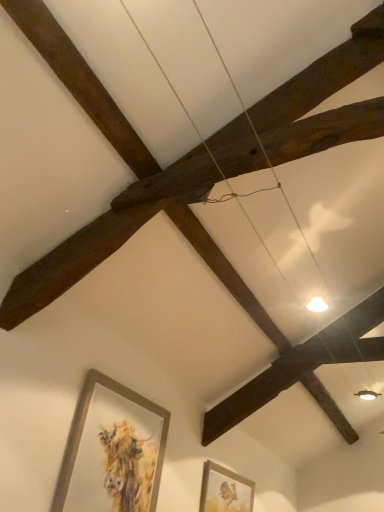
Describe the element at coordinates (225, 490) in the screenshot. The height and width of the screenshot is (512, 384). I see `matte gold picture frame at lower right, which appears as the first picture frame when viewed from the back` at that location.

Locate an element on the screen. The height and width of the screenshot is (512, 384). matte gold picture frame at lower right, which ranks as the 2th picture frame in left-to-right order is located at coordinates (225, 490).

This screenshot has width=384, height=512. What do you see at coordinates (112, 450) in the screenshot? I see `gold metallic picture frame at lower left, placed as the second picture frame when sorted from right to left` at bounding box center [112, 450].

Find the location of a particular element. The width and height of the screenshot is (384, 512). gold metallic picture frame at lower left, positioned as the 2th picture frame in back-to-front order is located at coordinates (112, 450).

Identify the location of matte gold picture frame at lower right, which appears as the first picture frame when viewed from the back. The image size is (384, 512). (225, 490).

Can you confirm if matte gold picture frame at lower right, which ranks as the 2th picture frame in left-to-right order, is positioned to the right of gold metallic picture frame at lower left, which appears as the first picture frame when viewed from the left?

Yes.

Is matte gold picture frame at lower right, which is counted as the 1th picture frame, starting from the right, further to the viewer compared to gold metallic picture frame at lower left, marked as the 2th picture frame in a bottom-to-top arrangement?

That is True.

Which point is more forward, (204,477) or (99,504)?

The point (99,504) is in front.

From the image's perspective, is matte gold picture frame at lower right, which is counted as the 1th picture frame, starting from the right, positioned above or below gold metallic picture frame at lower left, which appears as the first picture frame when viewed from the left?

matte gold picture frame at lower right, which is counted as the 1th picture frame, starting from the right, is below gold metallic picture frame at lower left, which appears as the first picture frame when viewed from the left.

From a real-world perspective, between matte gold picture frame at lower right, acting as the second picture frame starting from the front, and gold metallic picture frame at lower left, marked as the 2th picture frame in a bottom-to-top arrangement, who is vertically lower?

matte gold picture frame at lower right, acting as the second picture frame starting from the front, is physically lower.

Does matte gold picture frame at lower right, which appears as the first picture frame when viewed from the back, have a lesser width compared to gold metallic picture frame at lower left, which appears as the first picture frame when viewed from the left?

In fact, matte gold picture frame at lower right, which appears as the first picture frame when viewed from the back, might be wider than gold metallic picture frame at lower left, which appears as the first picture frame when viewed from the left.

Considering the sizes of matte gold picture frame at lower right, arranged as the first picture frame when ordered from the bottom, and gold metallic picture frame at lower left, which appears as the first picture frame when viewed from the left, in the image, is matte gold picture frame at lower right, arranged as the first picture frame when ordered from the bottom, taller or shorter than gold metallic picture frame at lower left, which appears as the first picture frame when viewed from the left,?

matte gold picture frame at lower right, arranged as the first picture frame when ordered from the bottom, is shorter than gold metallic picture frame at lower left, which appears as the first picture frame when viewed from the left.

Looking at the image, does matte gold picture frame at lower right, which ranks as the 2th picture frame in left-to-right order, seem bigger or smaller compared to gold metallic picture frame at lower left, which is the first picture frame in top-to-bottom order?

matte gold picture frame at lower right, which ranks as the 2th picture frame in left-to-right order, is smaller than gold metallic picture frame at lower left, which is the first picture frame in top-to-bottom order.

Is matte gold picture frame at lower right, which is counted as the 1th picture frame, starting from the right, located outside gold metallic picture frame at lower left, which appears as the first picture frame when viewed from the left?

Absolutely, matte gold picture frame at lower right, which is counted as the 1th picture frame, starting from the right, is external to gold metallic picture frame at lower left, which appears as the first picture frame when viewed from the left.

In the scene shown: Would you consider matte gold picture frame at lower right, which appears as the first picture frame when viewed from the back, to be distant from gold metallic picture frame at lower left, which ranks as the first picture frame in front-to-back order?

Yes.

Is matte gold picture frame at lower right, arranged as the first picture frame when ordered from the bottom, oriented away from gold metallic picture frame at lower left, which appears as the first picture frame when viewed from the left?

That's not correct — matte gold picture frame at lower right, arranged as the first picture frame when ordered from the bottom, is not looking away from gold metallic picture frame at lower left, which appears as the first picture frame when viewed from the left.

Could you measure the distance between matte gold picture frame at lower right, acting as the second picture frame starting from the front, and gold metallic picture frame at lower left, which ranks as the first picture frame in front-to-back order?

matte gold picture frame at lower right, acting as the second picture frame starting from the front, is 3.96 feet away from gold metallic picture frame at lower left, which ranks as the first picture frame in front-to-back order.

This screenshot has height=512, width=384. What are the coordinates of `picture frame above the matte gold picture frame at lower right, which appears as the first picture frame when viewed from the back (from the image's perspective)` in the screenshot? It's located at (112, 450).

Looking at this image, can you confirm if gold metallic picture frame at lower left, marked as the 2th picture frame in a bottom-to-top arrangement, is positioned to the right of matte gold picture frame at lower right, which appears as the first picture frame when viewed from the back?

In fact, gold metallic picture frame at lower left, marked as the 2th picture frame in a bottom-to-top arrangement, is to the left of matte gold picture frame at lower right, which appears as the first picture frame when viewed from the back.

Is gold metallic picture frame at lower left, marked as the 2th picture frame in a bottom-to-top arrangement, in front of or behind matte gold picture frame at lower right, which appears as the first picture frame when viewed from the back, in the image?

gold metallic picture frame at lower left, marked as the 2th picture frame in a bottom-to-top arrangement, is in front of matte gold picture frame at lower right, which appears as the first picture frame when viewed from the back.

Is point (105, 389) closer to camera compared to point (207, 468)?

Yes, it is.

From the image's perspective, is gold metallic picture frame at lower left, which appears as the first picture frame when viewed from the left, over matte gold picture frame at lower right, acting as the second picture frame starting from the front?

Yes.

From a real-world perspective, between gold metallic picture frame at lower left, which is the first picture frame in top-to-bottom order, and matte gold picture frame at lower right, which is counted as the 1th picture frame, starting from the right, who is vertically lower?

matte gold picture frame at lower right, which is counted as the 1th picture frame, starting from the right.

Between gold metallic picture frame at lower left, positioned as the 2th picture frame in back-to-front order, and matte gold picture frame at lower right, which is counted as the 1th picture frame, starting from the right, which one has smaller width?

gold metallic picture frame at lower left, positioned as the 2th picture frame in back-to-front order.

Is gold metallic picture frame at lower left, which ranks as the first picture frame in front-to-back order, taller or shorter than matte gold picture frame at lower right, which ranks as the 2th picture frame in left-to-right order?

Considering their sizes, gold metallic picture frame at lower left, which ranks as the first picture frame in front-to-back order, has more height than matte gold picture frame at lower right, which ranks as the 2th picture frame in left-to-right order.

Which of these two, gold metallic picture frame at lower left, which ranks as the first picture frame in front-to-back order, or matte gold picture frame at lower right, arranged as the first picture frame when ordered from the bottom, is smaller?

matte gold picture frame at lower right, arranged as the first picture frame when ordered from the bottom, is smaller.

Is gold metallic picture frame at lower left, which is the first picture frame in top-to-bottom order, not within matte gold picture frame at lower right, which ranks as the 2th picture frame in left-to-right order?

gold metallic picture frame at lower left, which is the first picture frame in top-to-bottom order, lies outside matte gold picture frame at lower right, which ranks as the 2th picture frame in left-to-right order,'s area.

In the scene shown: Is gold metallic picture frame at lower left, which appears as the first picture frame when viewed from the left, not close to matte gold picture frame at lower right, which appears as the first picture frame when viewed from the back?

Yes, gold metallic picture frame at lower left, which appears as the first picture frame when viewed from the left, is far from matte gold picture frame at lower right, which appears as the first picture frame when viewed from the back.

Could you tell me if gold metallic picture frame at lower left, marked as the 2th picture frame in a bottom-to-top arrangement, is turned towards matte gold picture frame at lower right, acting as the second picture frame starting from the front?

No.

Measure the distance from gold metallic picture frame at lower left, positioned as the 2th picture frame in back-to-front order, to matte gold picture frame at lower right, arranged as the first picture frame when ordered from the bottom.

gold metallic picture frame at lower left, positioned as the 2th picture frame in back-to-front order, and matte gold picture frame at lower right, arranged as the first picture frame when ordered from the bottom, are 1.21 meters apart from each other.

You are a GUI agent. You are given a task and a screenshot of the screen. Output one action in this format:
    pyautogui.click(x=<x>, y=<y>)
    Task: Click on the picture frame located behind the gold metallic picture frame at lower left, placed as the second picture frame when sorted from right to left
    
    Given the screenshot: What is the action you would take?
    225,490

Image resolution: width=384 pixels, height=512 pixels. In the image, there is a gold metallic picture frame at lower left, which appears as the first picture frame when viewed from the left. Identify the location of picture frame below it (from the image's perspective). (225, 490).

The width and height of the screenshot is (384, 512). I want to click on picture frame below the gold metallic picture frame at lower left, marked as the 2th picture frame in a bottom-to-top arrangement (from a real-world perspective), so click(x=225, y=490).